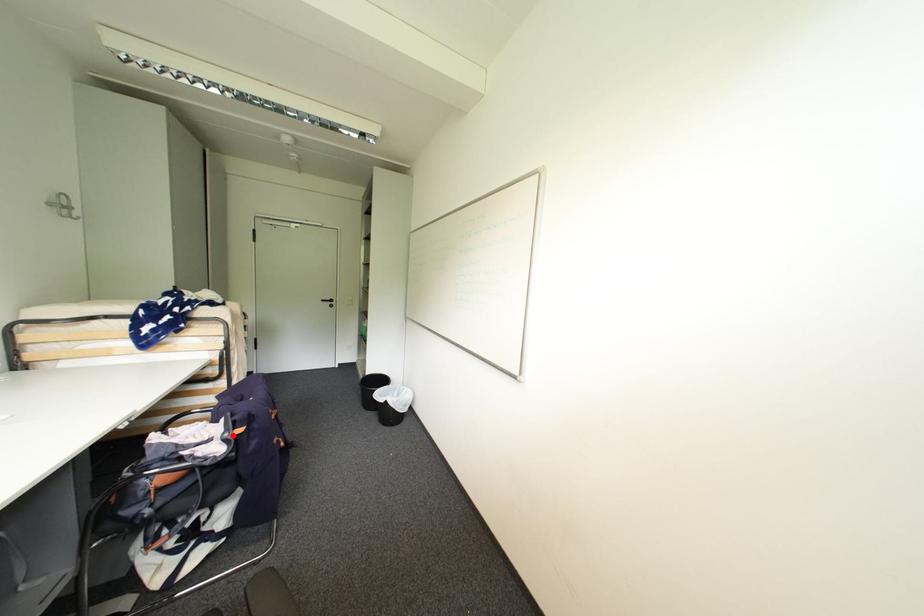
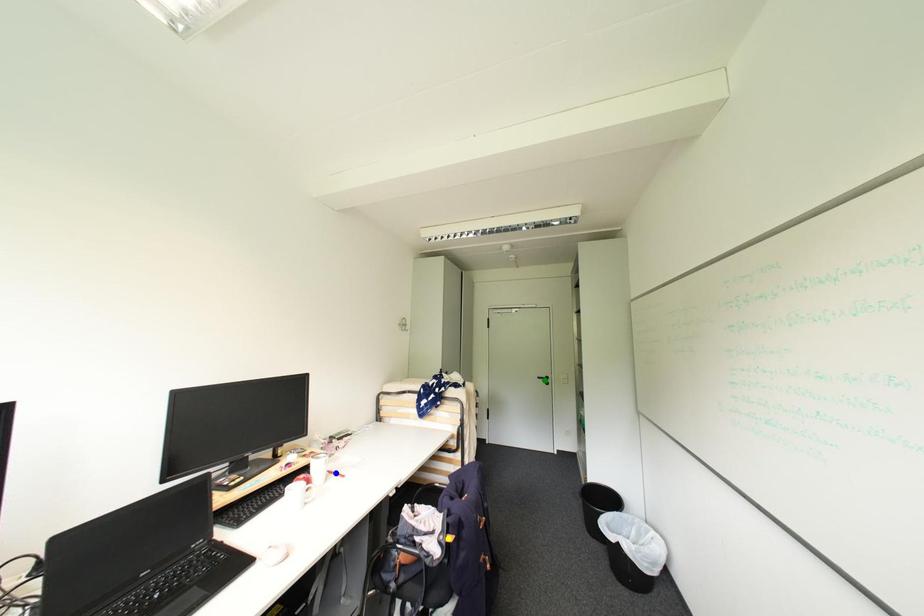
Question: I am providing you with two images of the same scene from different viewpoints. A red point is marked on the first image. You are given multiple points on the second image. In image 2, which mark is for the same physical point as the one in image 1?

Choices:
 (A) green point
 (B) yellow point
 (C) blue point

Answer: (B)